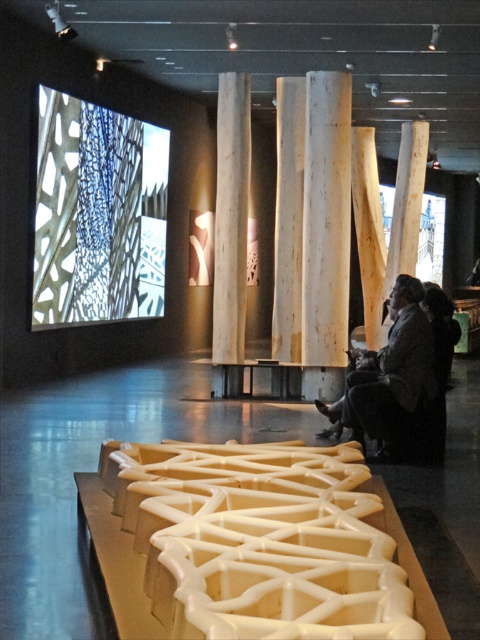
Question: Which object is farther from the camera taking this photo?

Choices:
 (A) natural wood pillar at center
 (B) dark gray fabric at lower right

Answer: (A)

Question: Which point is closer to the camera?

Choices:
 (A) natural wood pillar at center
 (B) dark gray fabric at lower right

Answer: (B)

Question: Is dark gray fabric at lower right thinner than natural wood pillar at center?

Choices:
 (A) yes
 (B) no

Answer: (B)

Question: Does dark gray fabric at lower right have a greater width compared to natural wood pillar at center?

Choices:
 (A) yes
 (B) no

Answer: (A)

Question: Is dark gray fabric at lower right closer to camera compared to natural wood pillar at center?

Choices:
 (A) yes
 (B) no

Answer: (A)